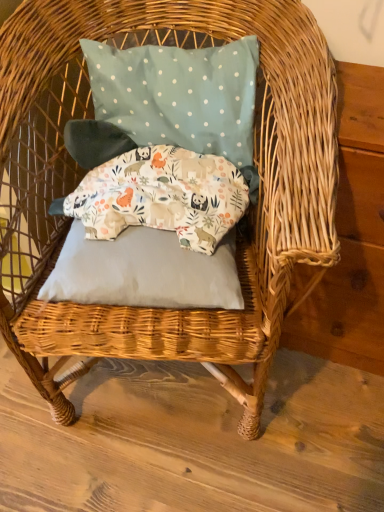
Question: Is teal polka dot fabric pillow at upper center, which ranks as the 3th pillow in bottom-to-top order, located outside gray fabric pillow at center, arranged as the first pillow when ordered from the bottom?

Choices:
 (A) no
 (B) yes

Answer: (B)

Question: Can you confirm if teal polka dot fabric pillow at upper center, the 1th pillow when ordered from top to bottom, is positioned to the right of gray fabric pillow at center, arranged as the first pillow when ordered from the bottom?

Choices:
 (A) no
 (B) yes

Answer: (B)

Question: Is teal polka dot fabric pillow at upper center, the 1th pillow when ordered from top to bottom, at the left side of gray fabric pillow at center, arranged as the 3th pillow when viewed from the top?

Choices:
 (A) no
 (B) yes

Answer: (A)

Question: Considering the relative positions of teal polka dot fabric pillow at upper center, the 1th pillow when ordered from top to bottom, and gray fabric pillow at center, arranged as the first pillow when ordered from the bottom, in the image provided, is teal polka dot fabric pillow at upper center, the 1th pillow when ordered from top to bottom, behind gray fabric pillow at center, arranged as the first pillow when ordered from the bottom,?

Choices:
 (A) no
 (B) yes

Answer: (B)

Question: Can you confirm if teal polka dot fabric pillow at upper center, the 1th pillow when ordered from top to bottom, is smaller than gray fabric pillow at center, arranged as the first pillow when ordered from the bottom?

Choices:
 (A) yes
 (B) no

Answer: (B)

Question: Is teal polka dot fabric pillow at upper center, the 1th pillow when ordered from top to bottom, next to gray fabric pillow at center, arranged as the first pillow when ordered from the bottom?

Choices:
 (A) no
 (B) yes

Answer: (A)

Question: From the image's perspective, is printed fabric pillow at center, placed as the second pillow when sorted from top to bottom, under teal polka dot fabric pillow at upper center, the 1th pillow when ordered from top to bottom?

Choices:
 (A) yes
 (B) no

Answer: (A)

Question: From a real-world perspective, is printed fabric pillow at center, placed as the second pillow when sorted from top to bottom, under teal polka dot fabric pillow at upper center, the 1th pillow when ordered from top to bottom?

Choices:
 (A) yes
 (B) no

Answer: (A)

Question: Does printed fabric pillow at center, the second pillow positioned from the bottom, have a greater height compared to teal polka dot fabric pillow at upper center, which ranks as the 3th pillow in bottom-to-top order?

Choices:
 (A) no
 (B) yes

Answer: (A)

Question: Would you say teal polka dot fabric pillow at upper center, the 1th pillow when ordered from top to bottom, is part of printed fabric pillow at center, placed as the second pillow when sorted from top to bottom,'s contents?

Choices:
 (A) yes
 (B) no

Answer: (B)

Question: Is printed fabric pillow at center, placed as the second pillow when sorted from top to bottom, oriented away from teal polka dot fabric pillow at upper center, which ranks as the 3th pillow in bottom-to-top order?

Choices:
 (A) yes
 (B) no

Answer: (B)

Question: Would you consider printed fabric pillow at center, the second pillow positioned from the bottom, to be distant from teal polka dot fabric pillow at upper center, which ranks as the 3th pillow in bottom-to-top order?

Choices:
 (A) no
 (B) yes

Answer: (A)

Question: Is the position of gray fabric pillow at center, arranged as the first pillow when ordered from the bottom, more distant than that of printed fabric pillow at center, the second pillow positioned from the bottom?

Choices:
 (A) yes
 (B) no

Answer: (B)